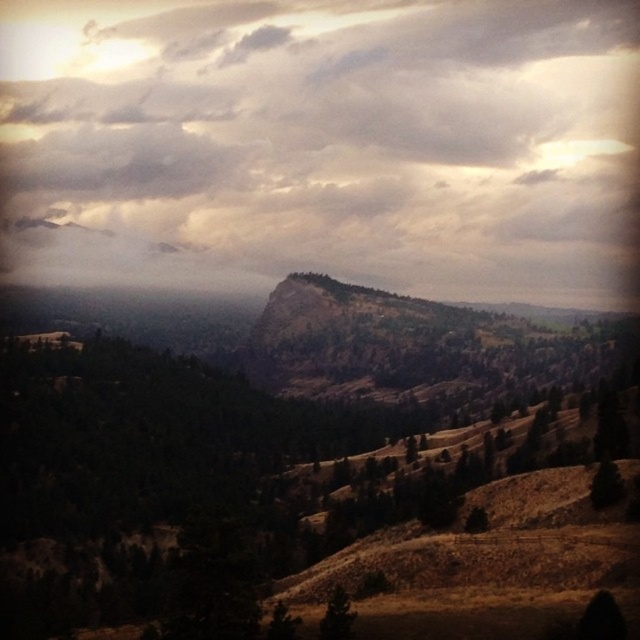
You are standing at the center of the image and want to locate the green matte tree at lower right. Based on the coordinates provided, in which cardinal direction should you look to find it?

The green matte tree at lower right is located at coordinates 0.758 on the x axis and 0.947 on the y axis. Since the x coordinate is closer to 1, it means it is positioned to the right side of the image. Therefore, you should look to the right direction to find the green matte tree at lower right.

You are an outdoor photographer planning to capture a landscape shot of the cloudy sky at upper center and the green matte tree at lower center. Considering their positions, which object would appear larger in your photo?

The cloudy sky at upper center appears larger in the photo because it is much taller than the green matte tree at lower center according to the description.